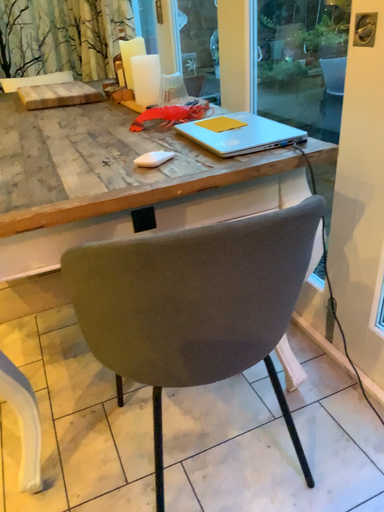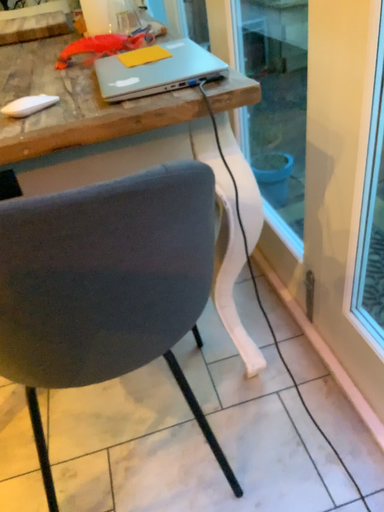
Question: Which way did the camera rotate in the video?

Choices:
 (A) rotated downward
 (B) rotated upward

Answer: (A)